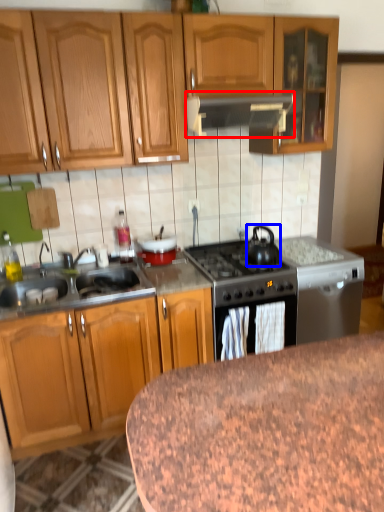
Question: Among these objects, which one is nearest to the camera, kitchen appliance (highlighted by a red box) or tea pot (highlighted by a blue box)?

Choices:
 (A) kitchen appliance
 (B) tea pot

Answer: (A)